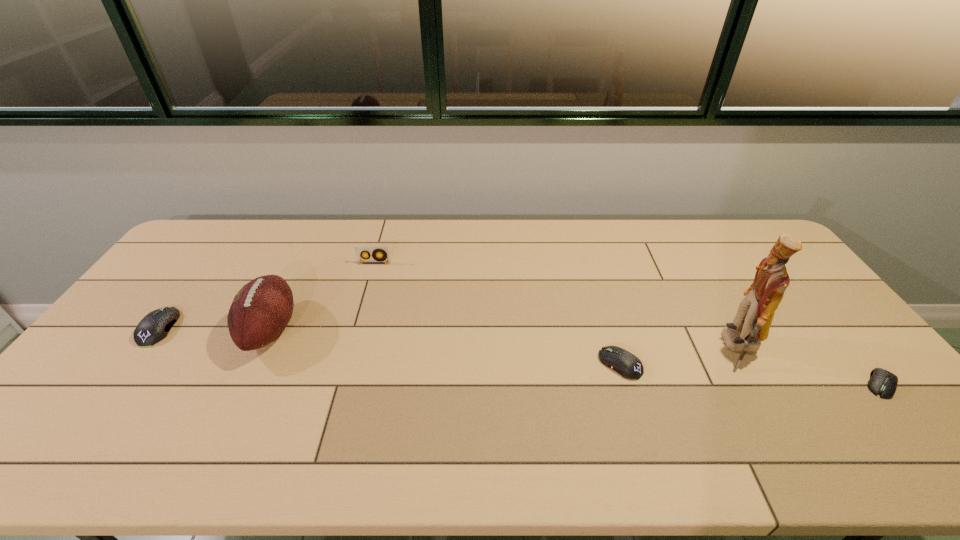
I want to click on the closest computer equipment to the fourth tallest object, so click(x=629, y=366).

This screenshot has height=540, width=960. I want to click on vacant region that satisfies the following two spatial constraints: 1. on the front side of the fifth object from right to left; 2. on the left side of the farthest computer equipment, so click(x=157, y=330).

Locate an element on the screen. This screenshot has width=960, height=540. free space that satisfies the following two spatial constraints: 1. on the back side of the rightmost object; 2. on the front-facing side of the tallest object is located at coordinates 852,348.

Where is `vacant position in the image that satisfies the following two spatial constraints: 1. at the front of the videotape with visible reels; 2. on the left side of the second computer equipment from right to left`? This screenshot has height=540, width=960. vacant position in the image that satisfies the following two spatial constraints: 1. at the front of the videotape with visible reels; 2. on the left side of the second computer equipment from right to left is located at coordinates (346, 364).

Identify the location of free space that satisfies the following two spatial constraints: 1. at the front of the second tallest computer equipment with visible reels; 2. on the left side of the farthest object. (346, 364).